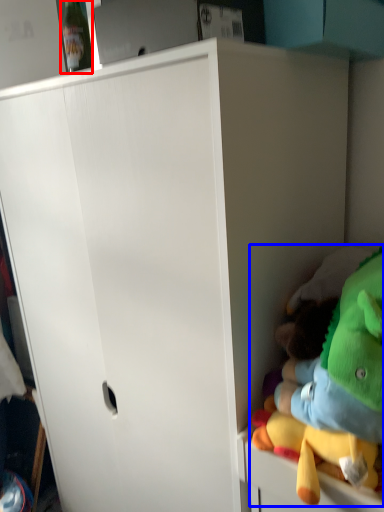
Question: Which point is further to the camera, bottle (highlighted by a red box) or toy (highlighted by a blue box)?

Choices:
 (A) bottle
 (B) toy

Answer: (A)